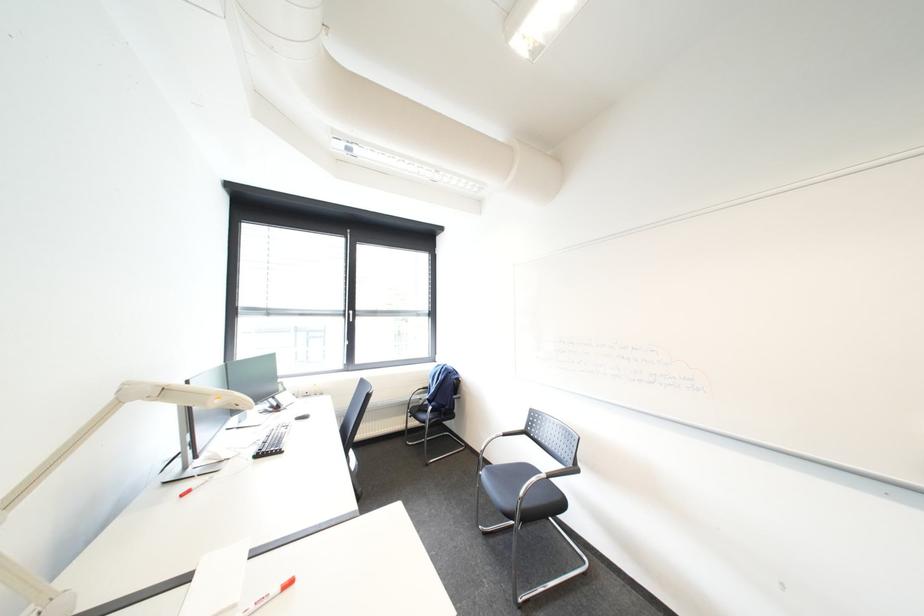
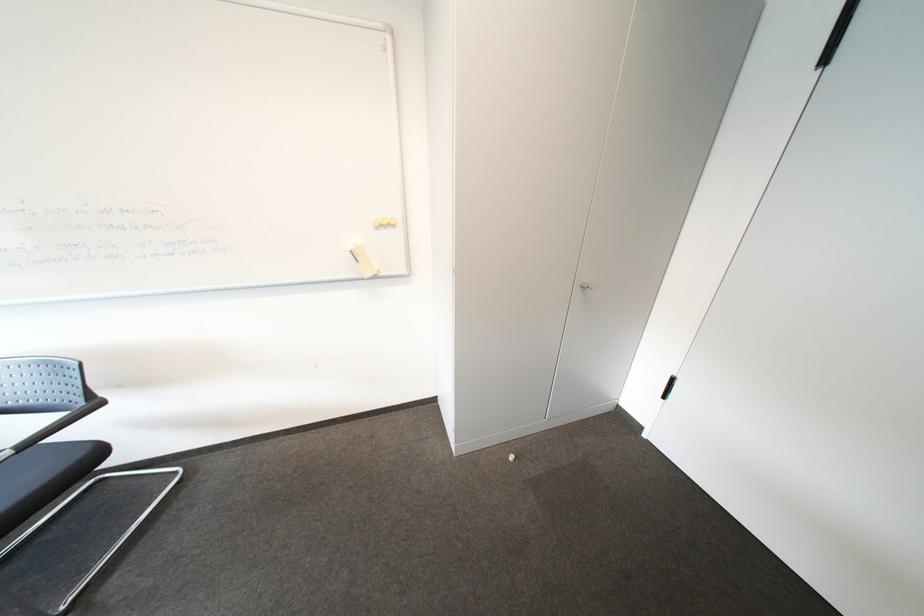
Based on the continuous images, in which direction is the camera rotating?

The camera's rotation is toward right-down.